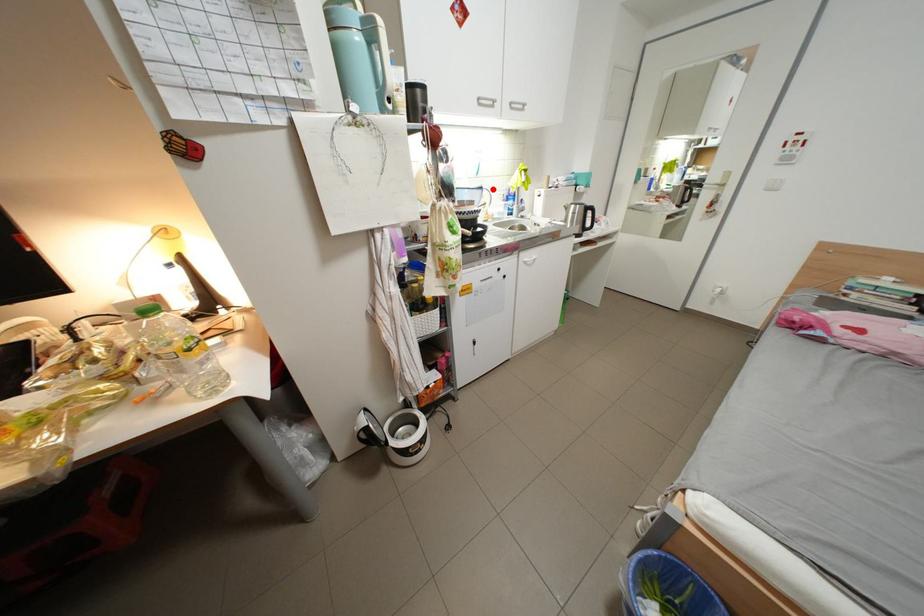
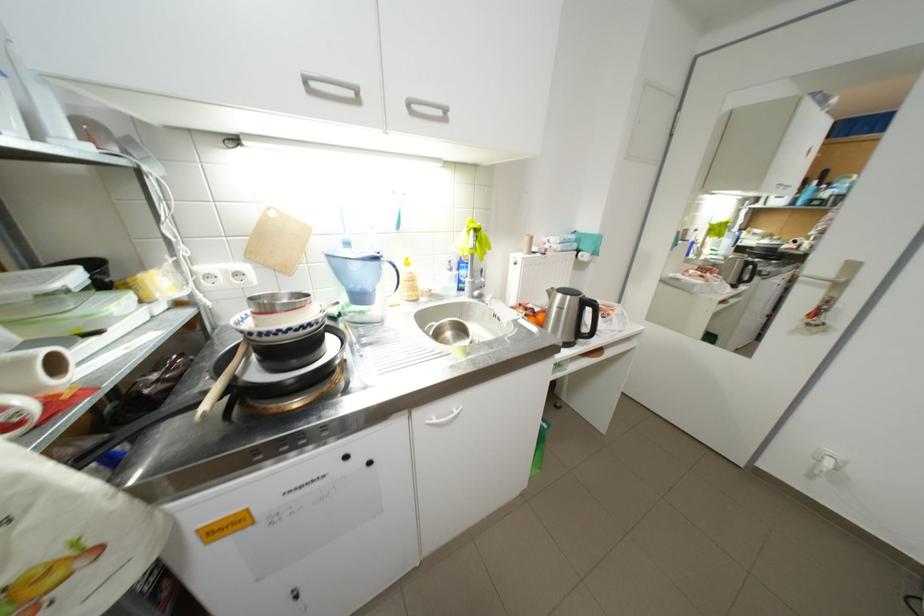
Find the pixel in the second image that matches the highlighted location in the first image.

(387, 259)